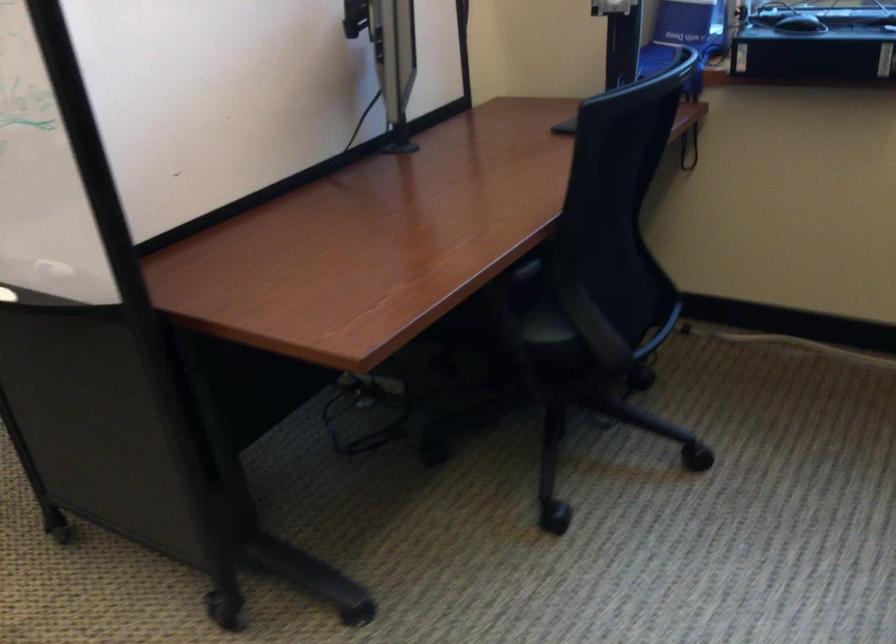
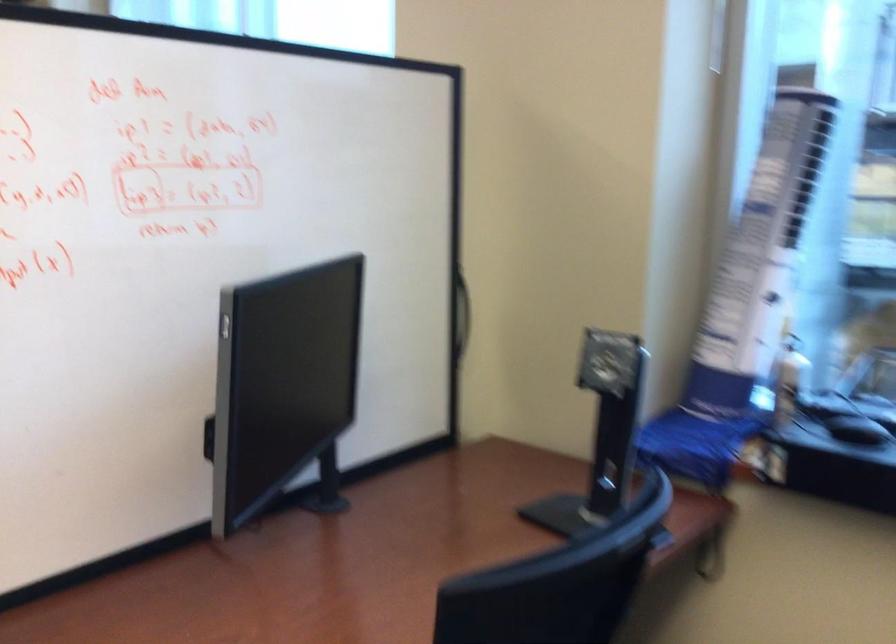
Locate, in the second image, the point that corresponds to (x=395, y=137) in the first image.

(325, 487)